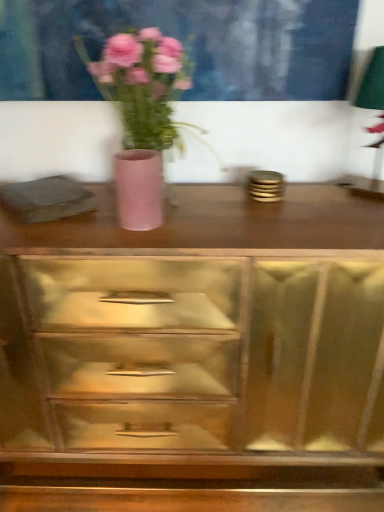
Question: Considering the relative sizes of wooden chest of drawers at center and matte pink vase at center in the image provided, is wooden chest of drawers at center bigger than matte pink vase at center?

Choices:
 (A) no
 (B) yes

Answer: (B)

Question: Can you see wooden chest of drawers at center touching matte pink vase at center?

Choices:
 (A) yes
 (B) no

Answer: (B)

Question: Is wooden chest of drawers at center looking in the opposite direction of matte pink vase at center?

Choices:
 (A) yes
 (B) no

Answer: (B)

Question: Considering the relative sizes of wooden chest of drawers at center and matte pink vase at center in the image provided, is wooden chest of drawers at center shorter than matte pink vase at center?

Choices:
 (A) yes
 (B) no

Answer: (B)

Question: Is wooden chest of drawers at center completely or partially outside of matte pink vase at center?

Choices:
 (A) no
 (B) yes

Answer: (B)

Question: In terms of width, does pink matte vase at center look wider or thinner when compared to matte pink vase at center?

Choices:
 (A) wide
 (B) thin

Answer: (A)

Question: From the image's perspective, is pink matte vase at center positioned above or below matte pink vase at center?

Choices:
 (A) above
 (B) below

Answer: (A)

Question: Based on their positions, is pink matte vase at center located to the left or right of matte pink vase at center?

Choices:
 (A) left
 (B) right

Answer: (B)

Question: Is pink matte vase at center inside the boundaries of matte pink vase at center, or outside?

Choices:
 (A) inside
 (B) outside

Answer: (B)

Question: Is wooden chest of drawers at center taller or shorter than pink matte vase at center?

Choices:
 (A) short
 (B) tall

Answer: (B)

Question: From the image's perspective, relative to pink matte vase at center, is wooden chest of drawers at center above or below?

Choices:
 (A) above
 (B) below

Answer: (B)

Question: Considering their positions, is wooden chest of drawers at center located in front of or behind pink matte vase at center?

Choices:
 (A) front
 (B) behind

Answer: (B)

Question: Is wooden chest of drawers at center inside or outside of pink matte vase at center?

Choices:
 (A) outside
 (B) inside

Answer: (A)

Question: Considering the positions of point (134, 154) and point (142, 130), is point (134, 154) closer or farther from the camera than point (142, 130)?

Choices:
 (A) farther
 (B) closer

Answer: (B)

Question: In the image, is matte pink vase at center positioned in front of or behind pink matte vase at center?

Choices:
 (A) front
 (B) behind

Answer: (B)